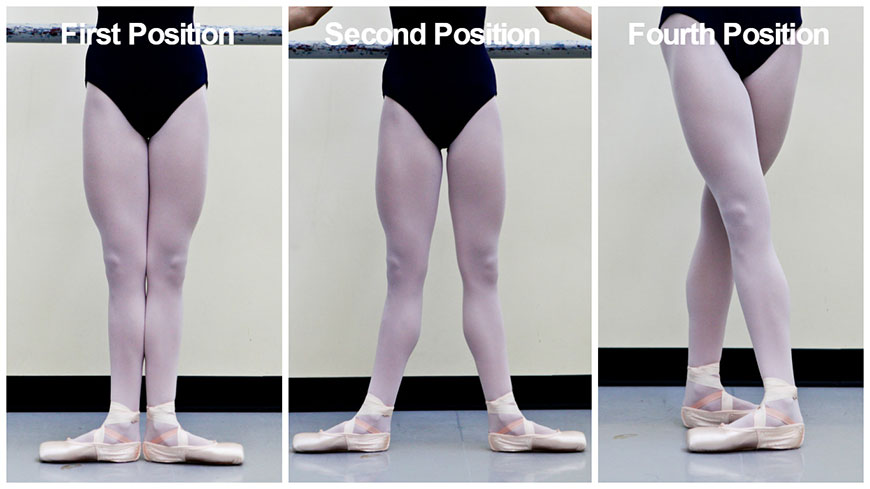
Find the location of `ballet bar`. ballet bar is located at coordinates (37, 33), (308, 43).